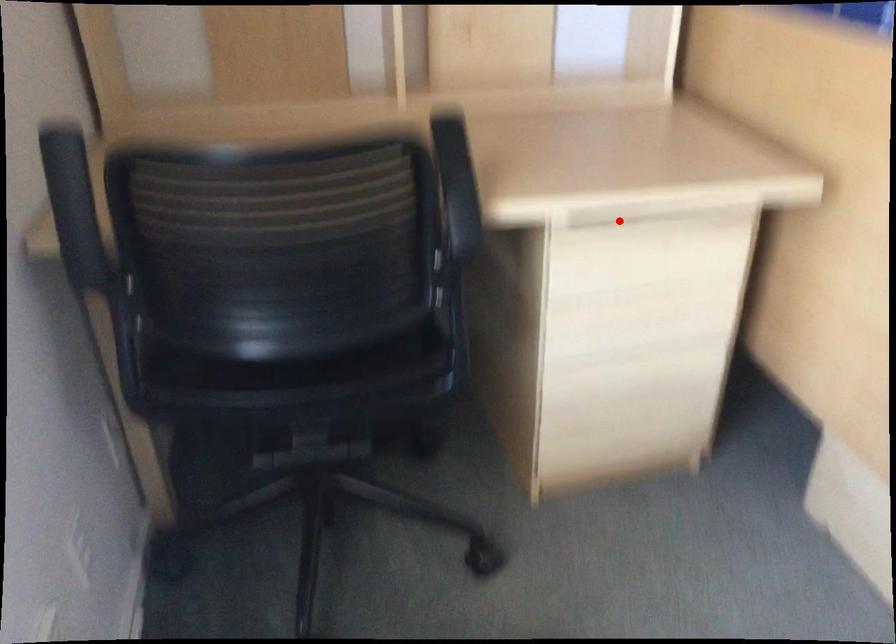
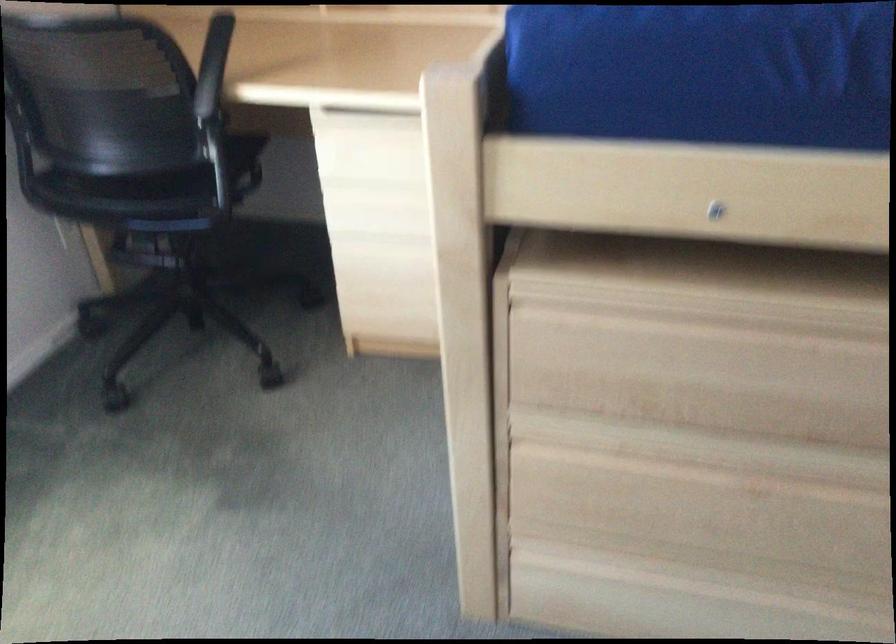
Find the pixel in the second image that matches the highlighted location in the first image.

(364, 117)